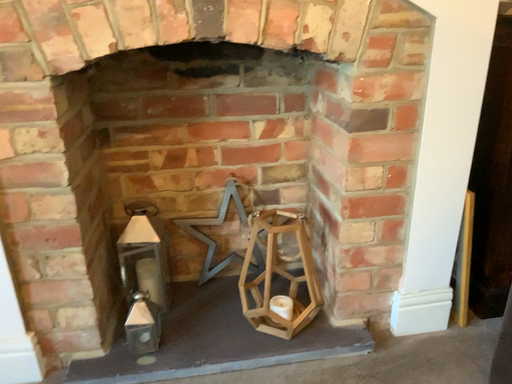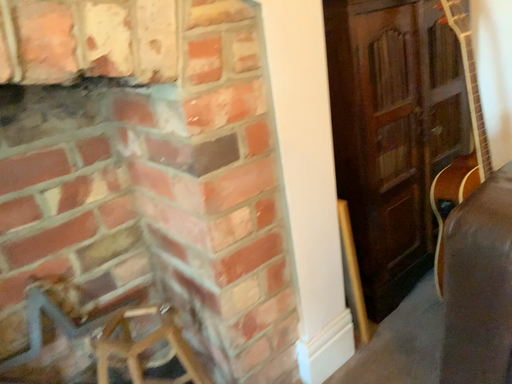
Question: Which way did the camera rotate in the video?

Choices:
 (A) rotated right
 (B) rotated left

Answer: (A)